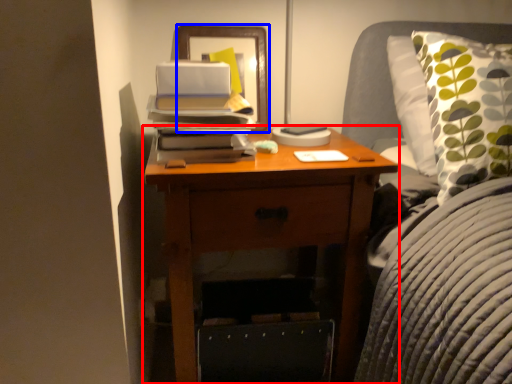
Question: Which object appears farthest to the camera in this image, nightstand (highlighted by a red box) or picture frame (highlighted by a blue box)?

Choices:
 (A) nightstand
 (B) picture frame

Answer: (B)